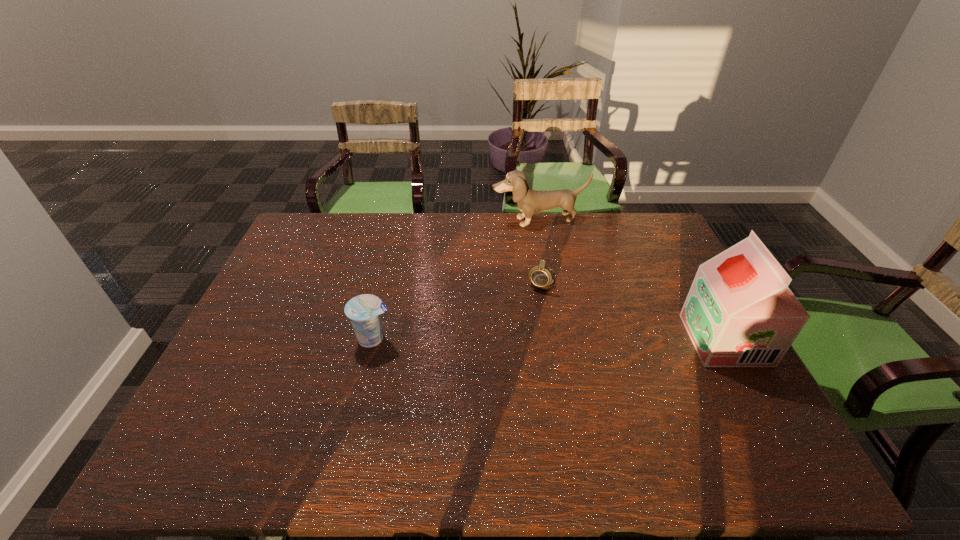
Where is `vacant space on the desktop that is between the leftmost object and the soya milk and is positioned at the face of the third shortest object`? The height and width of the screenshot is (540, 960). vacant space on the desktop that is between the leftmost object and the soya milk and is positioned at the face of the third shortest object is located at coordinates (594, 339).

Image resolution: width=960 pixels, height=540 pixels. Identify the location of vacant space on the desktop that is between the yogurt and the rightmost object and is positioned on the face of the compass. (512, 339).